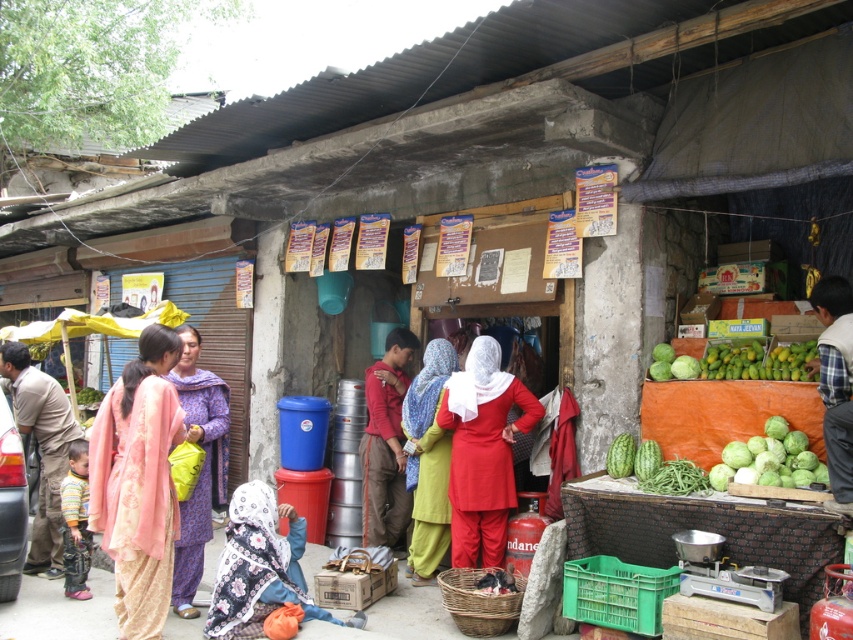
Question: Among these points, which one is farthest from the camera?

Choices:
 (A) (56, 516)
 (B) (676, 371)
 (C) (424, 404)
 (D) (154, 332)

Answer: (A)

Question: Can you confirm if matte red dress at center is positioned below green matte string beans at lower center?

Choices:
 (A) no
 (B) yes

Answer: (A)

Question: Is the position of matte red dress at center more distant than that of green matte string beans at lower center?

Choices:
 (A) yes
 (B) no

Answer: (A)

Question: Is matte red dress at center to the left of light green fabric at center from the viewer's perspective?

Choices:
 (A) yes
 (B) no

Answer: (B)

Question: Based on their relative distances, which object is farther from the red cotton shirt at center?

Choices:
 (A) light green fabric at center
 (B) purple fabric dress at center
 (C) plaid shirt at right

Answer: (C)

Question: Which object is closer to the camera taking this photo?

Choices:
 (A) green matte string beans at lower center
 (B) green matte cabbage at right
 (C) light green fabric at center
 (D) light brown cotton shirt at center

Answer: (A)